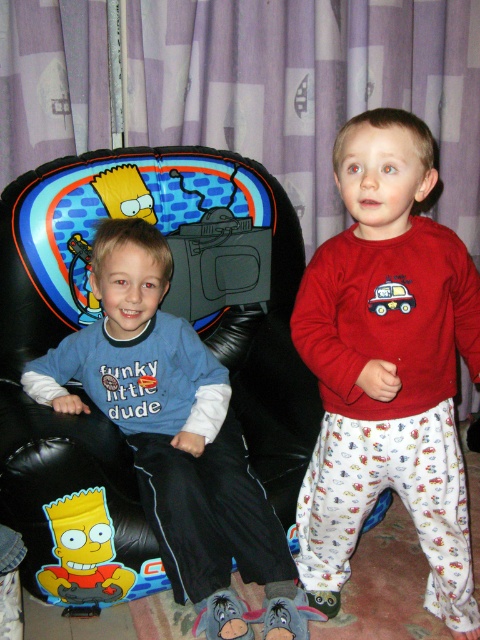
You are trying to decide whether to place a small toy on the floor between the matte blue shirt at center and the matte plastic car at right. Based on their widths, can the toy fit in that space?

The matte blue shirt at center might be wider than matte plastic car at right, so the space between them may not be sufficient for the toy to fit comfortably.